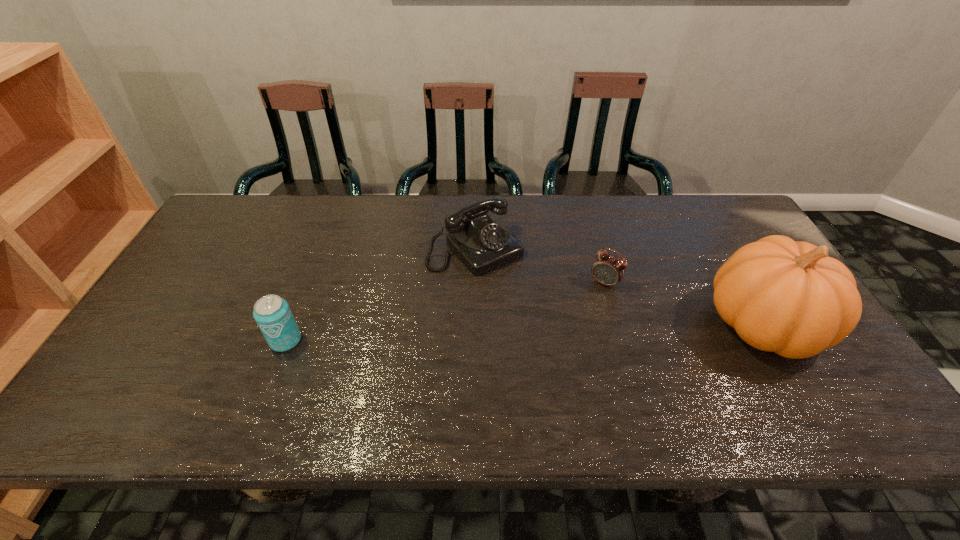
Identify the location of vacant region at the right edge of the desktop. (727, 260).

The width and height of the screenshot is (960, 540). In order to click on free location at the far left corner in this screenshot , I will do `click(229, 214)`.

Image resolution: width=960 pixels, height=540 pixels. I want to click on free spot at the near left corner of the desktop, so click(x=135, y=372).

At what (x,y) coordinates should I click in order to perform the action: click on empty space that is in between the pumpkin and the beer can. Please return your answer as a coordinate pair (x, y). Looking at the image, I should click on point(524,333).

At what (x,y) coordinates should I click in order to perform the action: click on vacant region between the leftmost object and the telephone. Please return your answer as a coordinate pair (x, y). Looking at the image, I should click on (380, 295).

The height and width of the screenshot is (540, 960). Find the location of `free space between the beer can and the alarm clock`. free space between the beer can and the alarm clock is located at coordinates (445, 312).

I want to click on vacant area between the second object from right to left and the tallest object, so click(684, 303).

Where is `free area in between the second object from right to left and the beer can`? The image size is (960, 540). free area in between the second object from right to left and the beer can is located at coordinates (445, 312).

Where is `free space that is in between the tallest object and the second object from left to right`? Image resolution: width=960 pixels, height=540 pixels. free space that is in between the tallest object and the second object from left to right is located at coordinates (619, 287).

Image resolution: width=960 pixels, height=540 pixels. I want to click on free point between the beer can and the third object from left to right, so click(445, 312).